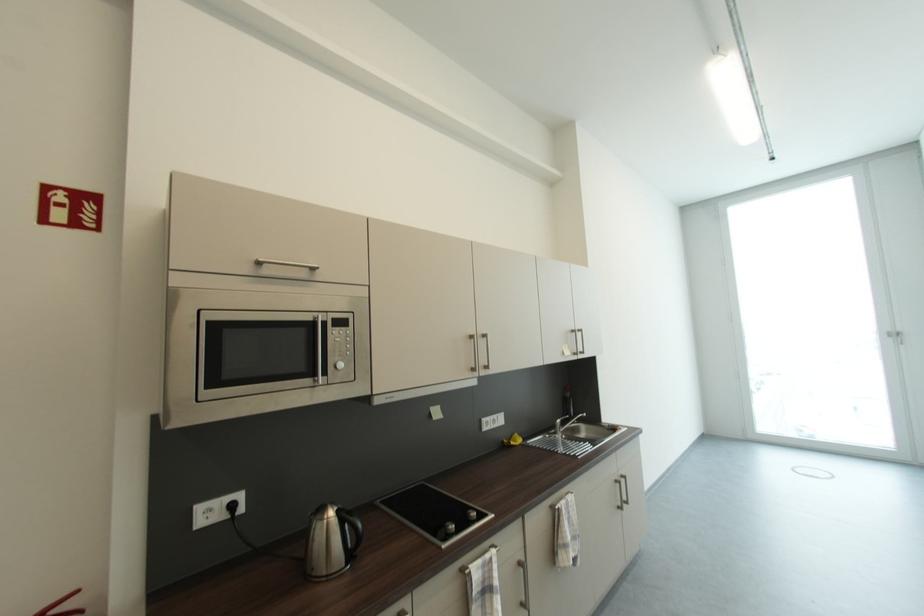
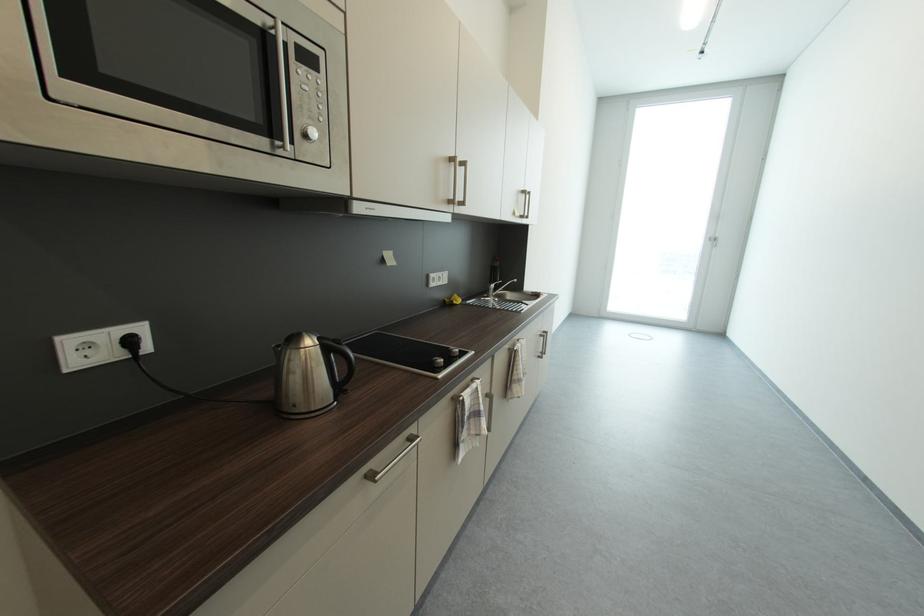
Locate, in the second image, the point that corresponds to point (511, 444) in the first image.

(453, 302)